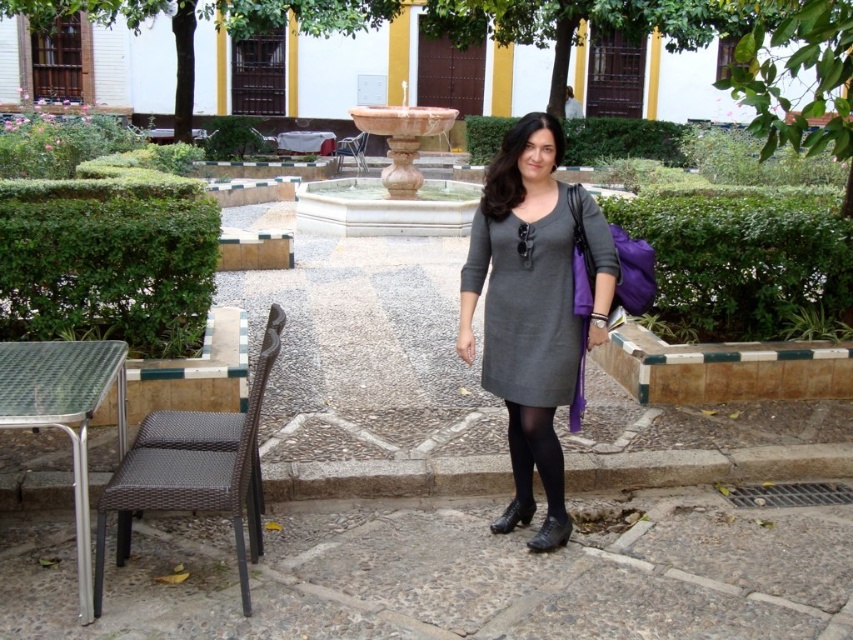
You are a visitor in the public square and want to sit down. You see a brown wicker chair at lower left and black tights at lower center. Which object is located to the left of the other?

The brown wicker chair at lower left is positioned on the left side of black tights at lower center.

You are a delivery person with a box that is 12 feet long. You need to place the box between the gray matte dress at center and the small table and chair set to the left. Is there enough space to fit the box between them?

The distance between the gray matte dress at center and the small table and chair set to the left is 11.95 feet. Since the box is 12 feet long, it will not fit between them as the space is slightly shorter than the box.